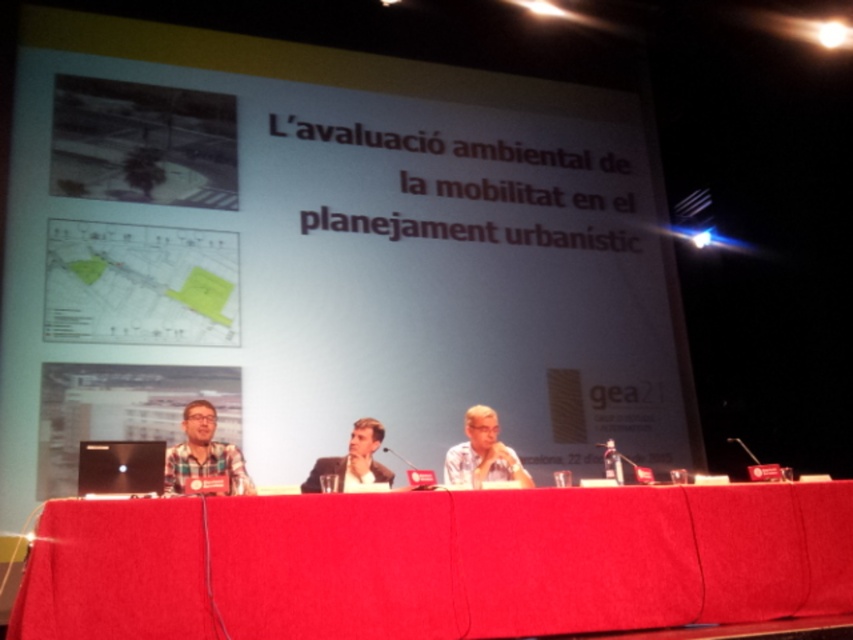
Question: Can you confirm if plaid fabric shirt at center is thinner than black plastic microphone at center?

Choices:
 (A) yes
 (B) no

Answer: (B)

Question: Which point is closer to the camera taking this photo?

Choices:
 (A) (85, 442)
 (B) (78, 624)
 (C) (171, 480)

Answer: (B)

Question: Is white paper at center positioned behind plaid fabric shirt at center?

Choices:
 (A) yes
 (B) no

Answer: (A)

Question: Among these objects, which one is farthest from the camera?

Choices:
 (A) smooth skin face at center
 (B) matte black glasses at center
 (C) red fabric table at center
 (D) white paper at center

Answer: (D)

Question: Does red fabric table at center come behind black plastic microphone at center?

Choices:
 (A) no
 (B) yes

Answer: (A)

Question: Based on their relative distances, which object is farther from the smooth skin face at center?

Choices:
 (A) red fabric table at center
 (B) black glossy laptop at center
 (C) black plastic microphone at center

Answer: (C)